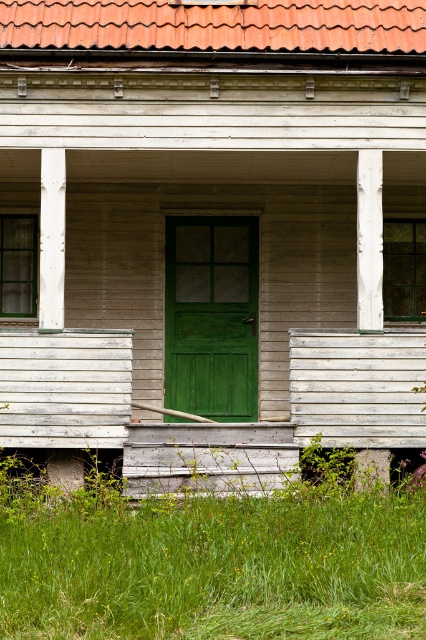
You are a painter planning to paint both the white wood column at left and the smooth white wooden post at lower right. Which object requires more paint due to its greater width?

The smooth white wooden post at lower right requires more paint because it has a greater width than the white wood column at left.

You are standing in front of the house and want to place a small garden statue exactly between the green grass at lower center and the white painted wood post at center. Which object will the statue be closer to?

The statue will be closer to the white painted wood post at center because the green grass at lower center is larger in size than the white painted wood post at center, meaning the distance between them would place the statue nearer to the smaller object.